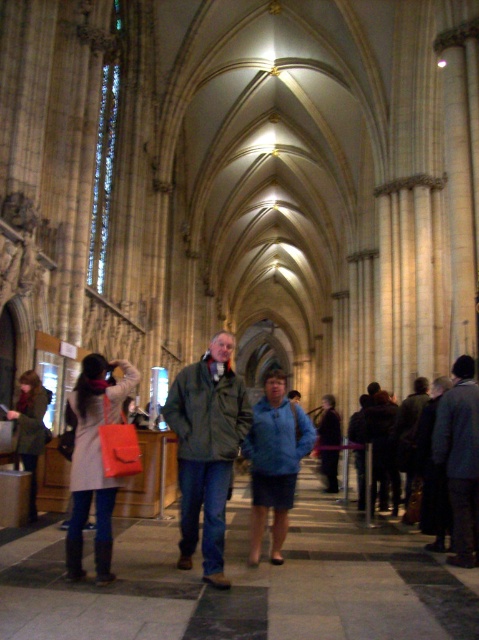
Question: Which object is closer to the camera taking this photo?

Choices:
 (A) dark gray wool coat at center
 (B) blue fabric jacket at center
 (C) dark blue fabric jacket at center
 (D) matte brown coat at lower left

Answer: (B)

Question: Does dark gray wool coat at center have a lesser width compared to dark blue fabric jacket at center?

Choices:
 (A) yes
 (B) no

Answer: (A)

Question: Based on their relative distances, which object is nearer to the green matte jacket at center?

Choices:
 (A) dark gray wool coat at center
 (B) dark blue fabric jacket at center

Answer: (A)

Question: Does green matte jacket at center have a lesser width compared to matte orange bag at center?

Choices:
 (A) no
 (B) yes

Answer: (B)

Question: Which of the following is the farthest from the observer?

Choices:
 (A) blue fabric jacket at center
 (B) dark gray wool coat at center
 (C) green matte jacket at center

Answer: (B)

Question: In this image, where is dark gray wool coat at center located relative to dark blue fabric jacket at center?

Choices:
 (A) left
 (B) right

Answer: (B)